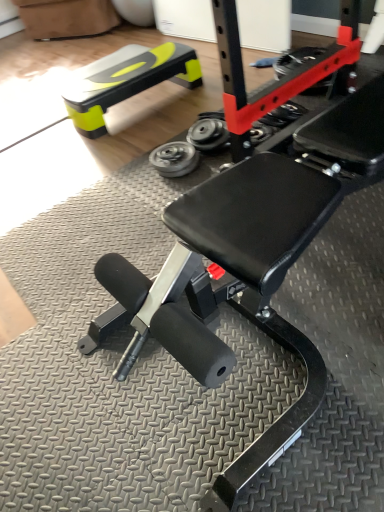
Question: From the image's perspective, would you say metallic silver wheel at center, which is the 2th wheel from right to left, is shown under rubber/soft tire at center?

Choices:
 (A) no
 (B) yes

Answer: (B)

Question: Does metallic silver wheel at center, placed as the first wheel when sorted from left to right, turn towards rubber/soft tire at center?

Choices:
 (A) no
 (B) yes

Answer: (A)

Question: Is metallic silver wheel at center, placed as the first wheel when sorted from left to right, at the right side of rubber/soft tire at center?

Choices:
 (A) no
 (B) yes

Answer: (A)

Question: Is metallic silver wheel at center, which is the 2th wheel from right to left, further to camera compared to rubber/soft tire at center?

Choices:
 (A) yes
 (B) no

Answer: (B)

Question: Is metallic silver wheel at center, which is the 2th wheel from right to left, far away from rubber/soft tire at center?

Choices:
 (A) no
 (B) yes

Answer: (A)

Question: Is point (283, 65) positioned closer to the camera than point (203, 123)?

Choices:
 (A) closer
 (B) farther

Answer: (B)

Question: From the image's perspective, relative to metallic gray wheel at center, the 2th wheel viewed from the left, is rubber/soft tire at center above or below?

Choices:
 (A) below
 (B) above

Answer: (B)

Question: Choose the correct answer: Is rubber/soft tire at center inside metallic gray wheel at center, the 1th wheel positioned from the right, or outside it?

Choices:
 (A) outside
 (B) inside

Answer: (A)

Question: In terms of width, does rubber/soft tire at center look wider or thinner when compared to metallic gray wheel at center, the 1th wheel positioned from the right?

Choices:
 (A) thin
 (B) wide

Answer: (B)

Question: From a real-world perspective, relative to neon yellow plastic bench at upper left, is rubber/soft tire at center vertically above or below?

Choices:
 (A) below
 (B) above

Answer: (A)

Question: In the image, is rubber/soft tire at center positioned in front of or behind neon yellow plastic bench at upper left?

Choices:
 (A) front
 (B) behind

Answer: (A)

Question: Would you say rubber/soft tire at center is inside or outside neon yellow plastic bench at upper left?

Choices:
 (A) outside
 (B) inside

Answer: (A)

Question: Would you say rubber/soft tire at center is to the left or to the right of neon yellow plastic bench at upper left in the picture?

Choices:
 (A) left
 (B) right

Answer: (B)

Question: Would you say metallic gray wheel at center, the 2th wheel viewed from the left, is inside or outside metallic silver wheel at center, which is the 2th wheel from right to left?

Choices:
 (A) inside
 (B) outside

Answer: (B)

Question: In terms of height, does metallic gray wheel at center, the 2th wheel viewed from the left, look taller or shorter compared to metallic silver wheel at center, which is the 2th wheel from right to left?

Choices:
 (A) short
 (B) tall

Answer: (B)